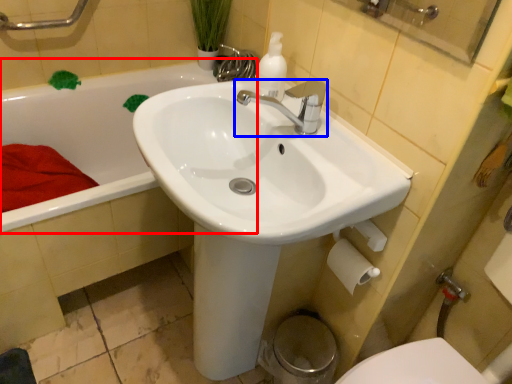
Question: Which of the following is the farthest to the observer, bathtub (highlighted by a red box) or tap (highlighted by a blue box)?

Choices:
 (A) bathtub
 (B) tap

Answer: (A)